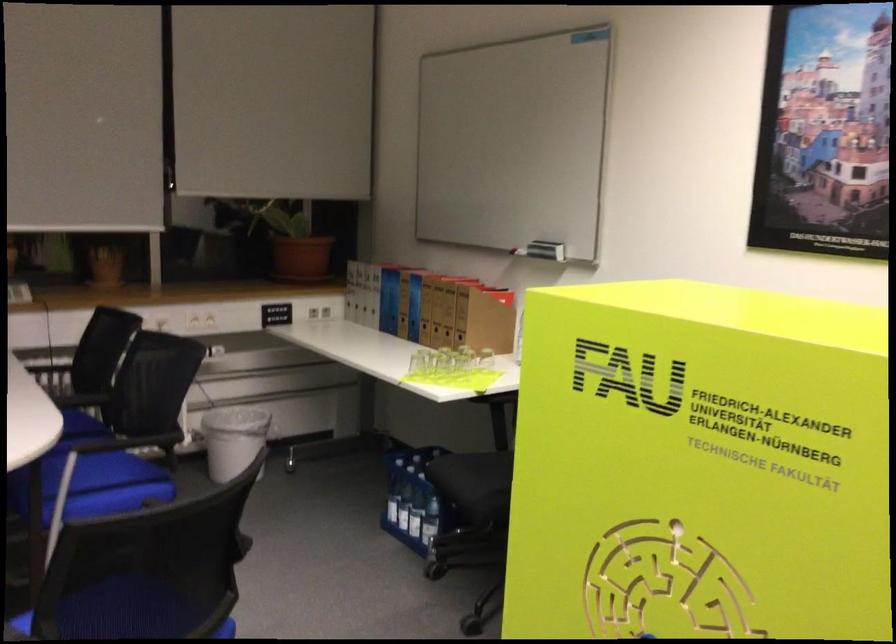
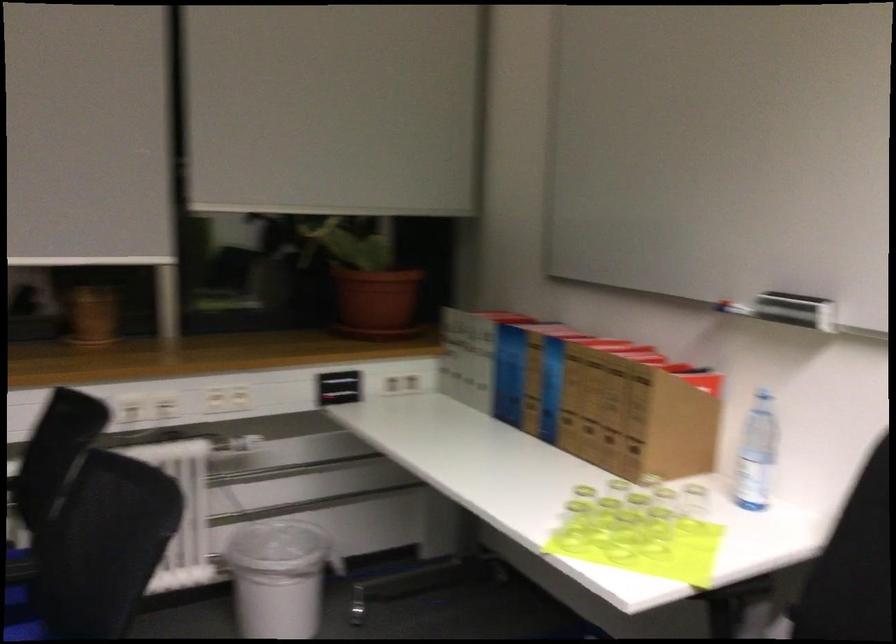
The point at (548, 247) is marked in the first image. Where is the corresponding point in the second image?

(795, 310)